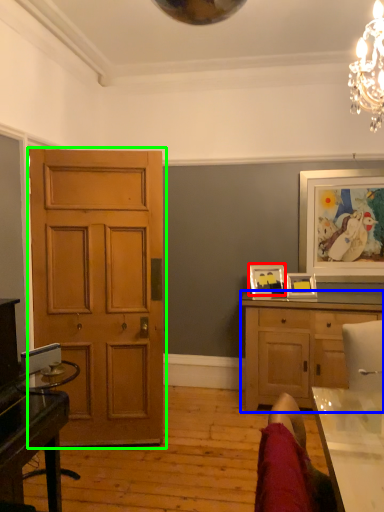
Question: Considering the real-world distances, which object is farthest from picture frame (highlighted by a red box)? cabinetry (highlighted by a blue box) or door (highlighted by a green box)?

Choices:
 (A) cabinetry
 (B) door

Answer: (B)